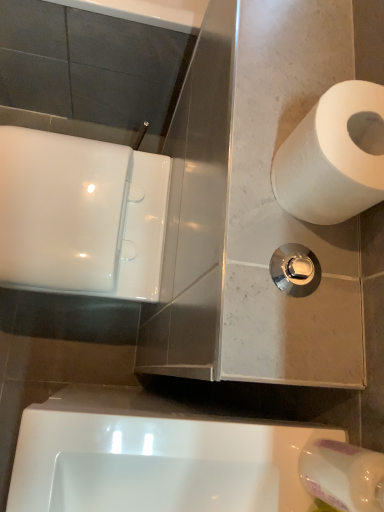
This screenshot has height=512, width=384. Identify the location of vacant space that is to the left of polished chrome flush handle at center-right. (249, 188).